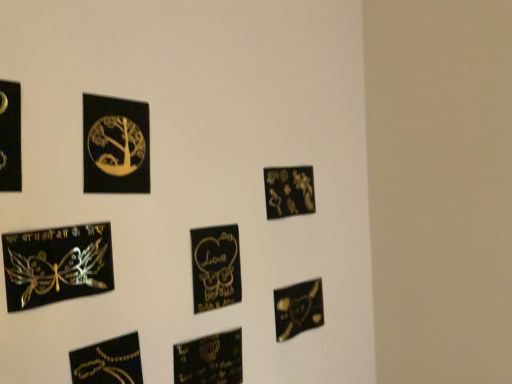
Question: Is black glossy picture frame at left, which is the eighth picture frame in right-to-left order, thinner than matte gold plaque at upper right, the seventh picture frame when ordered from left to right?

Choices:
 (A) yes
 (B) no

Answer: (A)

Question: From a real-world perspective, is black glossy picture frame at left, the 1th picture frame viewed from the left, beneath matte gold plaque at upper right, which ranks as the 2th picture frame in right-to-left order?

Choices:
 (A) yes
 (B) no

Answer: (B)

Question: Can you confirm if black glossy picture frame at left, the 1th picture frame viewed from the left, is shorter than matte gold plaque at upper right, the seventh picture frame when ordered from left to right?

Choices:
 (A) yes
 (B) no

Answer: (B)

Question: Does black glossy picture frame at left, which is the eighth picture frame in right-to-left order, have a larger size compared to matte gold plaque at upper right, the seventh picture frame when ordered from left to right?

Choices:
 (A) yes
 (B) no

Answer: (B)

Question: Is black glossy picture frame at left, which is the eighth picture frame in right-to-left order, looking in the opposite direction of matte gold plaque at upper right, the seventh picture frame when ordered from left to right?

Choices:
 (A) no
 (B) yes

Answer: (A)

Question: In the image, is matte gold plaque at upper right, which ranks as the 2th picture frame in right-to-left order, positioned in front of or behind metallic gold chain at lower left, which is counted as the 6th picture frame, starting from the right?

Choices:
 (A) behind
 (B) front

Answer: (A)

Question: From the image's perspective, is matte gold plaque at upper right, which ranks as the 2th picture frame in right-to-left order, located above or below metallic gold chain at lower left, placed as the 3th picture frame when sorted from left to right?

Choices:
 (A) above
 (B) below

Answer: (A)

Question: Which is correct: matte gold plaque at upper right, which ranks as the 2th picture frame in right-to-left order, is inside metallic gold chain at lower left, which is counted as the 6th picture frame, starting from the right, or outside of it?

Choices:
 (A) inside
 (B) outside

Answer: (B)

Question: Would you say matte gold plaque at upper right, which ranks as the 2th picture frame in right-to-left order, is to the left or to the right of metallic gold chain at lower left, which is counted as the 6th picture frame, starting from the right, in the picture?

Choices:
 (A) right
 (B) left

Answer: (A)

Question: Looking at their shapes, would you say matte black heart at lower center, acting as the fifth picture frame starting from the left, is wider or thinner than matte gold plaque at upper right, which ranks as the 2th picture frame in right-to-left order?

Choices:
 (A) thin
 (B) wide

Answer: (B)

Question: From their relative heights in the image, would you say matte black heart at lower center, acting as the fifth picture frame starting from the left, is taller or shorter than matte gold plaque at upper right, the seventh picture frame when ordered from left to right?

Choices:
 (A) tall
 (B) short

Answer: (B)

Question: In the image, is matte black heart at lower center, placed as the 4th picture frame when sorted from right to left, on the left side or the right side of matte gold plaque at upper right, the seventh picture frame when ordered from left to right?

Choices:
 (A) left
 (B) right

Answer: (A)

Question: From the image's perspective, is matte black heart at lower center, acting as the fifth picture frame starting from the left, positioned above or below matte gold plaque at upper right, which ranks as the 2th picture frame in right-to-left order?

Choices:
 (A) above
 (B) below

Answer: (B)

Question: From a real-world perspective, is matte black heart at lower right, placed as the 1th picture frame when sorted from right to left, positioned above or below matte black heart at lower center, placed as the 4th picture frame when sorted from right to left?

Choices:
 (A) below
 (B) above

Answer: (B)

Question: Relative to matte black heart at lower center, acting as the fifth picture frame starting from the left, is matte black heart at lower right, marked as the eighth picture frame in a left-to-right arrangement, in front or behind?

Choices:
 (A) front
 (B) behind

Answer: (B)